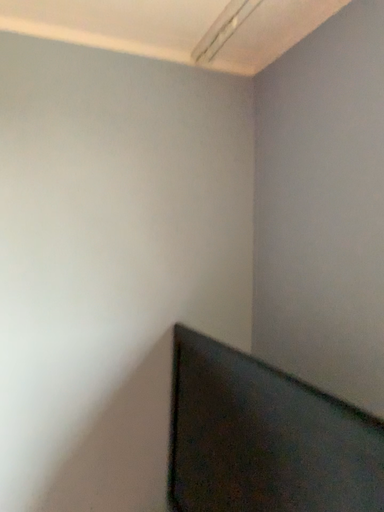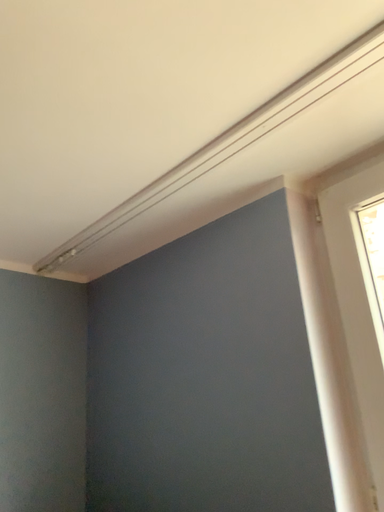
Question: How did the camera likely rotate when shooting the video?

Choices:
 (A) rotated left
 (B) rotated right

Answer: (B)